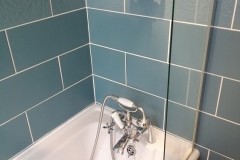
This screenshot has height=160, width=240. I want to click on left tile wall, so click(x=39, y=52).